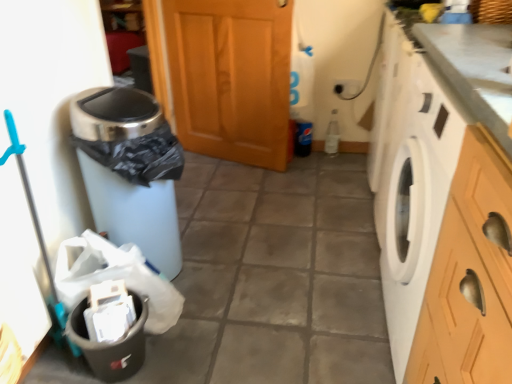
You are a GUI agent. You are given a task and a screenshot of the screen. Output one action in this format:
    pyautogui.click(x=<x>, y=<y>)
    Task: Click on the empty space that is to the right of matte plastic trash can at left
    This screenshot has width=512, height=384.
    Given the screenshot: What is the action you would take?
    (x=243, y=268)